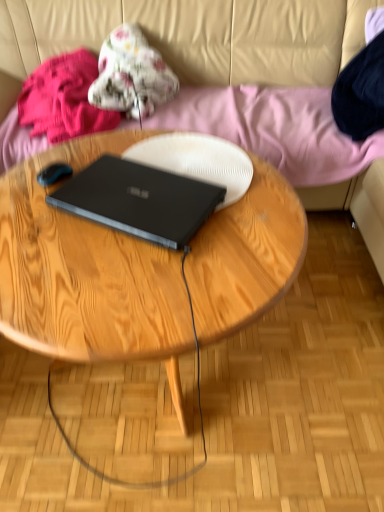
Measure the distance between beige leather couch at upper center and camera.

The depth of beige leather couch at upper center is 5.64 feet.

Locate an element on the screen. beige leather couch at upper center is located at coordinates tap(192, 37).

Describe the element at coordinates (139, 200) in the screenshot. This screenshot has height=512, width=384. I see `black matte laptop at center` at that location.

The image size is (384, 512). I want to click on black matte laptop at center, so click(139, 200).

At what (x,y) coordinates should I click in order to perform the action: click on fluffy pink blanket at upper left, marked as the first clothing in a left-to-right arrangement. Please return your answer as a coordinate pair (x, y). The width and height of the screenshot is (384, 512). Looking at the image, I should click on (63, 99).

Would you say black matte laptop at center is inside or outside fluffy pink blanket at upper left, marked as the first clothing in a left-to-right arrangement?

black matte laptop at center is not enclosed by fluffy pink blanket at upper left, marked as the first clothing in a left-to-right arrangement.

In the scene shown: From a real-world perspective, which is physically below, black matte laptop at center or fluffy pink blanket at upper left, the 2th clothing viewed from the right?

fluffy pink blanket at upper left, the 2th clothing viewed from the right, is physically lower.

From the image's perspective, is black matte laptop at center on fluffy pink blanket at upper left, the 2th clothing viewed from the right?

Actually, black matte laptop at center appears below fluffy pink blanket at upper left, the 2th clothing viewed from the right, in the image.

Can you confirm if beige leather couch at upper center is positioned to the left of wooden coffee table at center?

Indeed, beige leather couch at upper center is positioned on the left side of wooden coffee table at center.

At what (x,y) coordinates should I click in order to perform the action: click on coffee table below the beige leather couch at upper center (from a real-world perspective). Please return your answer as a coordinate pair (x, y). Looking at the image, I should click on (87, 276).

Is the surface of beige leather couch at upper center in direct contact with wooden coffee table at center?

No, beige leather couch at upper center is not with wooden coffee table at center.

Is wooden coffee table at center at the back of beige leather couch at upper center?

No, beige leather couch at upper center is not facing away from wooden coffee table at center.

Considering the sizes of wooden coffee table at center and black matte laptop at center in the image, is wooden coffee table at center bigger or smaller than black matte laptop at center?

Clearly, wooden coffee table at center is larger in size than black matte laptop at center.

From a real-world perspective, relative to black matte laptop at center, is wooden coffee table at center vertically above or below?

From a real-world perspective, wooden coffee table at center is physically below black matte laptop at center.

Is wooden coffee table at center next to black matte laptop at center?

They are not placed beside each other.

From a real-world perspective, which is physically below, beige leather couch at upper center or fluffy floral blanket at upper center, placed as the 2th clothing when sorted from left to right?

From a 3D spatial view, beige leather couch at upper center is below.

Is beige leather couch at upper center oriented away from fluffy floral blanket at upper center, placed as the 2th clothing when sorted from left to right?

Yes, beige leather couch at upper center's orientation is away from fluffy floral blanket at upper center, placed as the 2th clothing when sorted from left to right.

Does beige leather couch at upper center have a lesser height compared to fluffy floral blanket at upper center, placed as the 2th clothing when sorted from left to right?

In fact, beige leather couch at upper center may be taller than fluffy floral blanket at upper center, placed as the 2th clothing when sorted from left to right.

Which object is more forward, beige leather couch at upper center or black matte laptop at center?

black matte laptop at center.

Is black matte laptop at center at the back of beige leather couch at upper center?

No, beige leather couch at upper center's orientation is not away from black matte laptop at center.

Is point (371, 166) positioned before point (163, 188)?

No, (371, 166) is behind (163, 188).

From the image's perspective, who appears lower, beige leather couch at upper center or black matte laptop at center?

black matte laptop at center, from the image's perspective.

Considering the positions of point (206, 202) and point (140, 99), is point (206, 202) closer or farther from the camera than point (140, 99)?

Point (206, 202) is positioned closer to the camera compared to point (140, 99).

From a real-world perspective, is black matte laptop at center located beneath fluffy floral blanket at upper center, placed as the 2th clothing when sorted from left to right?

No, from a real-world perspective, black matte laptop at center is not below fluffy floral blanket at upper center, placed as the 2th clothing when sorted from left to right.

Is black matte laptop at center facing towards fluffy floral blanket at upper center, placed as the 2th clothing when sorted from left to right?

No, black matte laptop at center is not turned towards fluffy floral blanket at upper center, placed as the 2th clothing when sorted from left to right.

You are a GUI agent. You are given a task and a screenshot of the screen. Output one action in this format:
    pyautogui.click(x=<x>, y=<y>)
    Task: Click on the laptop on the right of fluffy floral blanket at upper center, placed as the 2th clothing when sorted from left to right
    
    Given the screenshot: What is the action you would take?
    tap(139, 200)

From a real-world perspective, is beige leather couch at upper center under fluffy pink blanket at upper left, marked as the first clothing in a left-to-right arrangement?

Correct, in the physical world, beige leather couch at upper center is lower than fluffy pink blanket at upper left, marked as the first clothing in a left-to-right arrangement.

Could fluffy pink blanket at upper left, the 2th clothing viewed from the right, be considered to be inside beige leather couch at upper center?

Yes, fluffy pink blanket at upper left, the 2th clothing viewed from the right, is inside beige leather couch at upper center.

From the image's perspective, is beige leather couch at upper center positioned above or below fluffy pink blanket at upper left, marked as the first clothing in a left-to-right arrangement?

beige leather couch at upper center is situated higher than fluffy pink blanket at upper left, marked as the first clothing in a left-to-right arrangement, in the image.

You are a GUI agent. You are given a task and a screenshot of the screen. Output one action in this format:
    pyautogui.click(x=<x>, y=<y>)
    Task: Click on the clothing located below the beige leather couch at upper center (from the image's perspective)
    The height and width of the screenshot is (512, 384).
    Given the screenshot: What is the action you would take?
    pyautogui.click(x=63, y=99)

Where is `the 1st clothing above the black matte laptop at center (from the image's perspective)`? The image size is (384, 512). the 1st clothing above the black matte laptop at center (from the image's perspective) is located at coordinates (63, 99).

Identify the location of studio couch on the left of the wooden coffee table at center. (192, 37).

Considering their positions, is fluffy floral blanket at upper center, which is the 1th clothing from right to left, positioned closer to beige leather couch at upper center than wooden coffee table at center?

Among the two, fluffy floral blanket at upper center, which is the 1th clothing from right to left, is located nearer to beige leather couch at upper center.

Looking at the image, which one is located further to fluffy floral blanket at upper center, which is the 1th clothing from right to left, beige leather couch at upper center or fluffy pink blanket at upper left, marked as the first clothing in a left-to-right arrangement?

The object further to fluffy floral blanket at upper center, which is the 1th clothing from right to left, is beige leather couch at upper center.

Based on their spatial positions, is black matte laptop at center or wooden coffee table at center further from fluffy floral blanket at upper center, which is the 1th clothing from right to left?

Among the two, black matte laptop at center is located further to fluffy floral blanket at upper center, which is the 1th clothing from right to left.

Considering their positions, is wooden coffee table at center positioned further to fluffy floral blanket at upper center, which is the 1th clothing from right to left, than black matte laptop at center?

Based on the image, black matte laptop at center appears to be further to fluffy floral blanket at upper center, which is the 1th clothing from right to left.

Which object lies further to the anchor point black matte laptop at center, wooden coffee table at center or fluffy pink blanket at upper left, marked as the first clothing in a left-to-right arrangement?

fluffy pink blanket at upper left, marked as the first clothing in a left-to-right arrangement.

Based on their spatial positions, is black matte laptop at center or beige leather couch at upper center further from fluffy floral blanket at upper center, placed as the 2th clothing when sorted from left to right?

black matte laptop at center is further to fluffy floral blanket at upper center, placed as the 2th clothing when sorted from left to right.

Considering their positions, is fluffy pink blanket at upper left, marked as the first clothing in a left-to-right arrangement, positioned closer to beige leather couch at upper center than wooden coffee table at center?

Among the two, fluffy pink blanket at upper left, marked as the first clothing in a left-to-right arrangement, is located nearer to beige leather couch at upper center.

Looking at the image, which one is located closer to fluffy pink blanket at upper left, marked as the first clothing in a left-to-right arrangement, fluffy floral blanket at upper center, placed as the 2th clothing when sorted from left to right, or beige leather couch at upper center?

Among the two, fluffy floral blanket at upper center, placed as the 2th clothing when sorted from left to right, is located nearer to fluffy pink blanket at upper left, marked as the first clothing in a left-to-right arrangement.

Where is `laptop between fluffy pink blanket at upper left, marked as the first clothing in a left-to-right arrangement, and wooden coffee table at center from top to bottom`? The image size is (384, 512). laptop between fluffy pink blanket at upper left, marked as the first clothing in a left-to-right arrangement, and wooden coffee table at center from top to bottom is located at coordinates (139, 200).

This screenshot has width=384, height=512. What are the coordinates of `clothing between fluffy floral blanket at upper center, which is the 1th clothing from right to left, and wooden coffee table at center vertically` in the screenshot? It's located at (63, 99).

Find the location of a particular element. studio couch between fluffy floral blanket at upper center, placed as the 2th clothing when sorted from left to right, and wooden coffee table at center vertically is located at coordinates (192, 37).

What are the coordinates of `clothing between beige leather couch at upper center and wooden coffee table at center from top to bottom` in the screenshot? It's located at (63, 99).